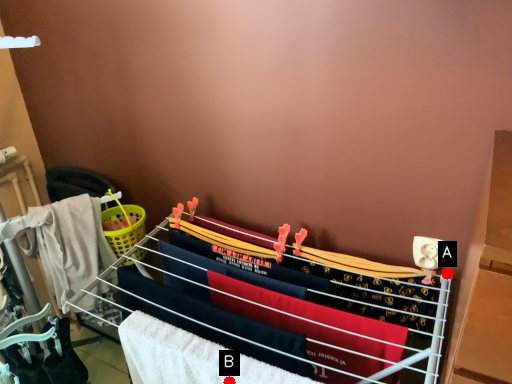
Question: Two points are circled on the image, labeled by A and B beside each circle. Which of the following is the farthest from the observer?

Choices:
 (A) A is further
 (B) B is further

Answer: (A)